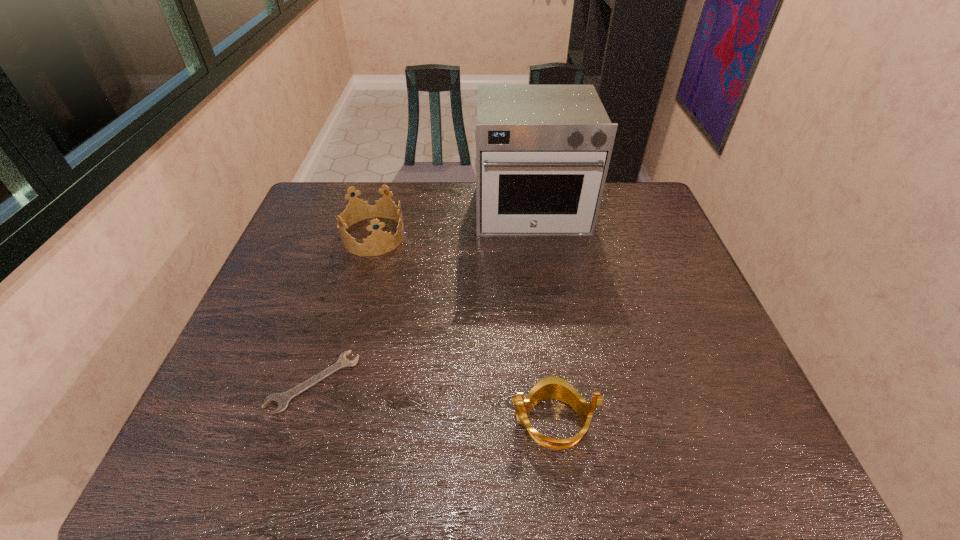
This screenshot has width=960, height=540. Identify the location of the tallest object. (542, 151).

This screenshot has height=540, width=960. I want to click on the second tallest object, so click(379, 242).

The width and height of the screenshot is (960, 540). I want to click on the taller tiara, so click(379, 242).

Find the location of `the right tiara`. the right tiara is located at coordinates (556, 388).

The height and width of the screenshot is (540, 960). I want to click on the shorter tiara, so click(x=556, y=388).

Locate an element on the screen. The image size is (960, 540). the shortest object is located at coordinates (282, 399).

Where is `vacant region located 0.240m on the front panel of the tallest object`? This screenshot has width=960, height=540. vacant region located 0.240m on the front panel of the tallest object is located at coordinates (544, 298).

This screenshot has width=960, height=540. Identify the location of blank space located 0.070m on the front-facing side of the left tiara. (427, 236).

Identify the location of vacant space located at the front emblem of the nearer tiara. The width and height of the screenshot is (960, 540). (370, 422).

Where is `blank space located at the front emblem of the nearer tiara`? The height and width of the screenshot is (540, 960). blank space located at the front emblem of the nearer tiara is located at coordinates (360, 422).